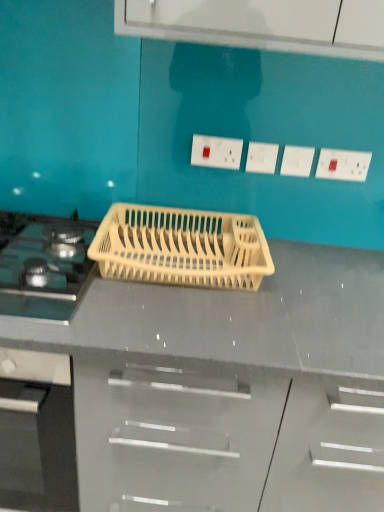
Question: Is beige plastic dish rack at center taller than matte black gas stove at left?

Choices:
 (A) no
 (B) yes

Answer: (B)

Question: From a real-world perspective, is beige plastic dish rack at center beneath matte black gas stove at left?

Choices:
 (A) no
 (B) yes

Answer: (A)

Question: Can you confirm if beige plastic dish rack at center is positioned to the right of matte black gas stove at left?

Choices:
 (A) yes
 (B) no

Answer: (A)

Question: Is beige plastic dish rack at center oriented away from matte black gas stove at left?

Choices:
 (A) yes
 (B) no

Answer: (B)

Question: From the image's perspective, is beige plastic dish rack at center on matte black gas stove at left?

Choices:
 (A) no
 (B) yes

Answer: (B)

Question: Is beige plastic dish rack at center smaller than matte black gas stove at left?

Choices:
 (A) yes
 (B) no

Answer: (A)

Question: Does white plastic electric outlet at upper center, the second electric outlet from the right, appear on the right side of beige plastic dish rack at center?

Choices:
 (A) yes
 (B) no

Answer: (A)

Question: From a real-world perspective, is white plastic electric outlet at upper center, the third electric outlet from the left, physically above beige plastic dish rack at center?

Choices:
 (A) no
 (B) yes

Answer: (B)

Question: Is white plastic electric outlet at upper center, the third electric outlet from the left, surrounding beige plastic dish rack at center?

Choices:
 (A) no
 (B) yes

Answer: (A)

Question: Can you confirm if white plastic electric outlet at upper center, the third electric outlet from the left, is wider than beige plastic dish rack at center?

Choices:
 (A) no
 (B) yes

Answer: (A)

Question: Does white plastic electric outlet at upper center, the second electric outlet from the right, turn towards beige plastic dish rack at center?

Choices:
 (A) no
 (B) yes

Answer: (A)

Question: Is white plastic electric outlet at upper center, the second electric outlet from the right, far from beige plastic dish rack at center?

Choices:
 (A) no
 (B) yes

Answer: (A)

Question: Is beige plastic dish rack at center taller than white plastic electric outlet at upper center, which is the second electric outlet from left to right?

Choices:
 (A) no
 (B) yes

Answer: (B)